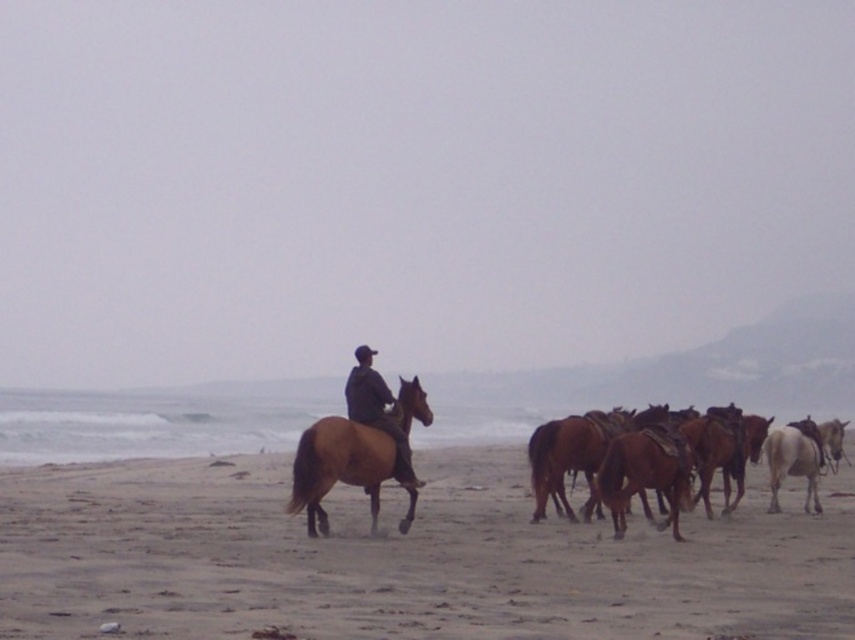
You are standing at the origin point of the coordinate system. You see two points, point (576, 435) and point (398, 445). Which point is closer to you?

Point (398, 445) is closer to you because it is in front of point (576, 435).

You are standing on the beach and see two points marked on the sand. The first point is at coordinate point(302,506) and the second is at point(587,456). Which point is closer to you?

Point(302,506) is in front of point(587,456), so it is closer to you.